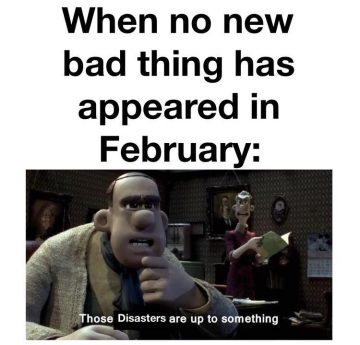
Identify the location of picture frame. (221, 191).